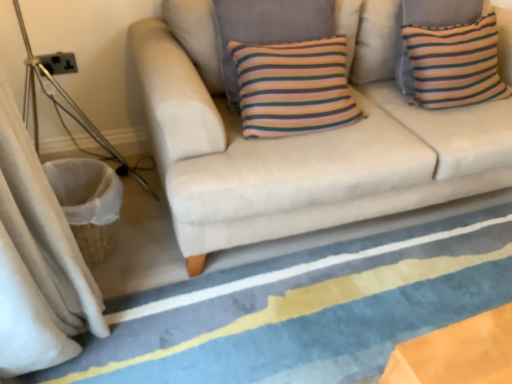
Question: Would you say beige fabric curtain at left is inside or outside striped fabric pillow at upper right?

Choices:
 (A) inside
 (B) outside

Answer: (B)

Question: From a real-world perspective, is beige fabric curtain at left above or below striped fabric pillow at upper right?

Choices:
 (A) above
 (B) below

Answer: (B)

Question: Which of these objects is positioned closest to the beige fabric couch at center?

Choices:
 (A) blue striped rug at lower center
 (B) striped fabric pillow at upper right
 (C) beige fabric curtain at left

Answer: (B)

Question: Which of these objects is positioned farthest from the striped fabric pillow at upper right?

Choices:
 (A) blue striped rug at lower center
 (B) beige fabric couch at center
 (C) beige fabric curtain at left

Answer: (C)